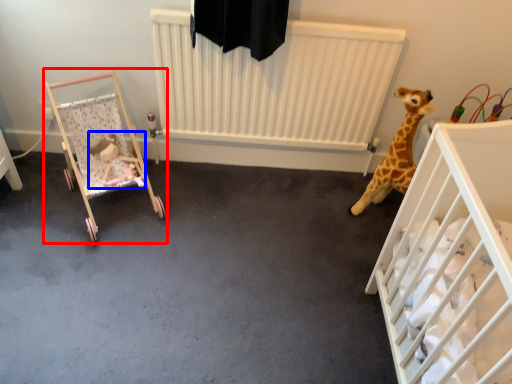
Question: Which of the following is the farthest to the observer, infant bed (highlighted by a red box) or toy (highlighted by a blue box)?

Choices:
 (A) infant bed
 (B) toy

Answer: (B)